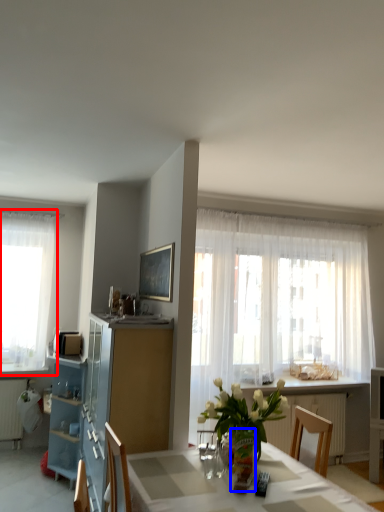
Question: Which object appears farthest to the camera in this image, curtain (highlighted by a red box) or vase (highlighted by a blue box)?

Choices:
 (A) curtain
 (B) vase

Answer: (A)